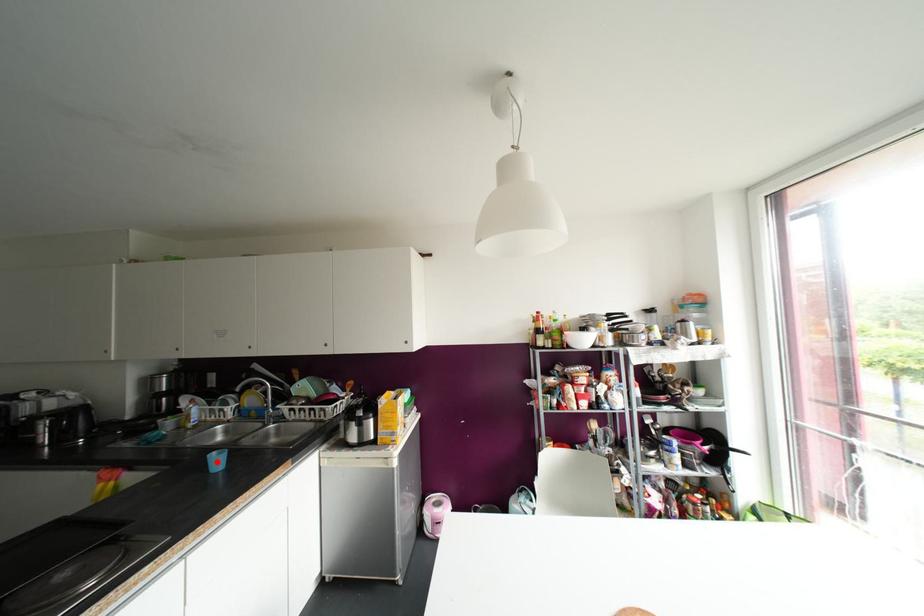
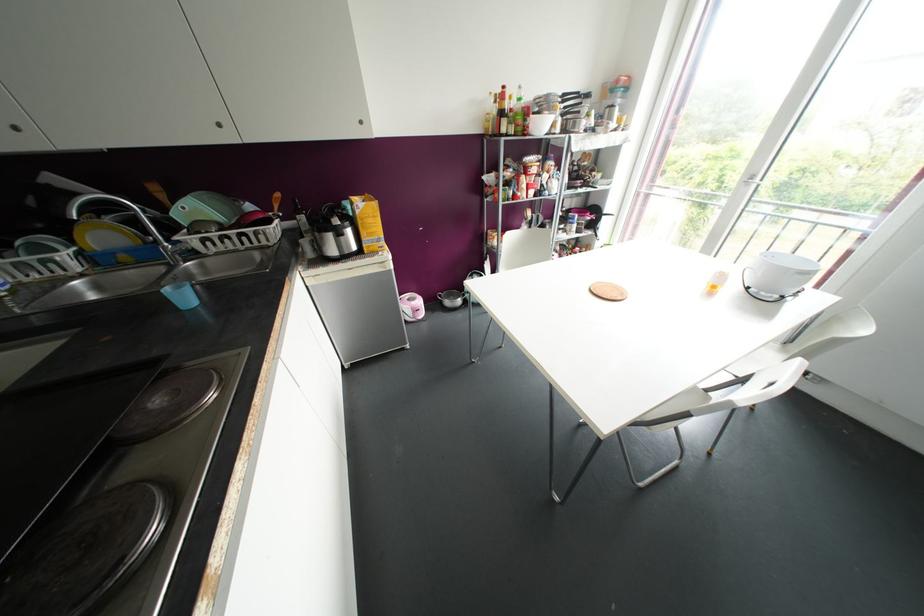
Locate, in the second image, the point that corresponds to the highlighted location in the first image.

(184, 297)